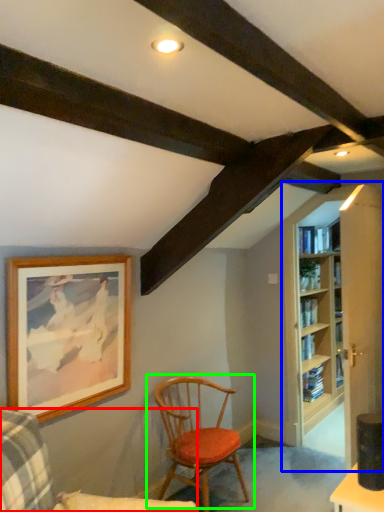
Question: Based on their relative distances, which object is farther from chair (highlighted by a red box)? Choose from bookcase (highlighted by a blue box) and chair (highlighted by a green box).

Choices:
 (A) bookcase
 (B) chair

Answer: (A)